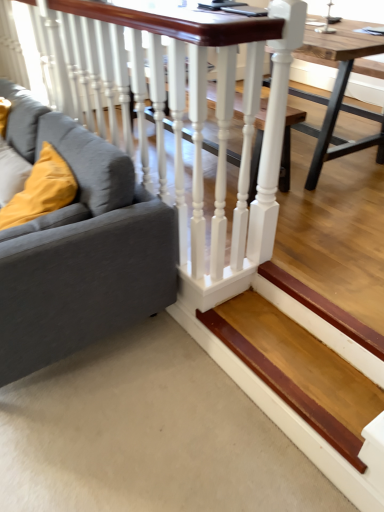
Question: Is velvet yellow pillow at left positioned far away from white glossy rail at upper left?

Choices:
 (A) yes
 (B) no

Answer: (B)

Question: Can you confirm if velvet yellow pillow at left is bigger than white glossy rail at upper left?

Choices:
 (A) no
 (B) yes

Answer: (A)

Question: Considering the relative sizes of velvet yellow pillow at left and white glossy rail at upper left in the image provided, is velvet yellow pillow at left thinner than white glossy rail at upper left?

Choices:
 (A) no
 (B) yes

Answer: (A)

Question: Is velvet yellow pillow at left not within white glossy rail at upper left?

Choices:
 (A) no
 (B) yes

Answer: (B)

Question: Does velvet yellow pillow at left have a smaller size compared to white glossy rail at upper left?

Choices:
 (A) no
 (B) yes

Answer: (B)

Question: Looking at their shapes, would you say wooden table at center is wider or thinner than white glossy rail at upper left?

Choices:
 (A) thin
 (B) wide

Answer: (B)

Question: In the image, is wooden table at center positioned in front of or behind white glossy rail at upper left?

Choices:
 (A) behind
 (B) front

Answer: (A)

Question: Is wooden table at center inside or outside of white glossy rail at upper left?

Choices:
 (A) outside
 (B) inside

Answer: (A)

Question: Considering the relative positions of wooden table at center and white glossy rail at upper left in the image provided, is wooden table at center to the left or to the right of white glossy rail at upper left?

Choices:
 (A) right
 (B) left

Answer: (A)

Question: Is wooden stair at lower right in front of or behind white glossy rail at upper left in the image?

Choices:
 (A) behind
 (B) front

Answer: (A)

Question: From a real-world perspective, relative to white glossy rail at upper left, is wooden stair at lower right vertically above or below?

Choices:
 (A) below
 (B) above

Answer: (A)

Question: Considering the positions of wooden stair at lower right and white glossy rail at upper left in the image, is wooden stair at lower right taller or shorter than white glossy rail at upper left?

Choices:
 (A) short
 (B) tall

Answer: (A)

Question: Which is correct: wooden stair at lower right is inside white glossy rail at upper left, or outside of it?

Choices:
 (A) inside
 (B) outside

Answer: (B)

Question: Is velvet yellow pillow at left taller or shorter than wooden table at center?

Choices:
 (A) tall
 (B) short

Answer: (B)

Question: Relative to wooden table at center, is velvet yellow pillow at left in front or behind?

Choices:
 (A) front
 (B) behind

Answer: (A)